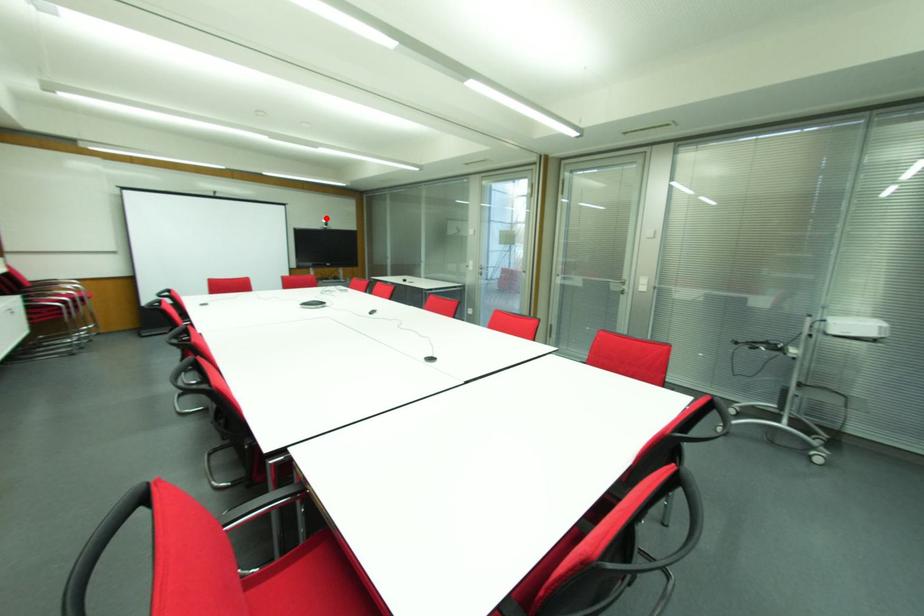
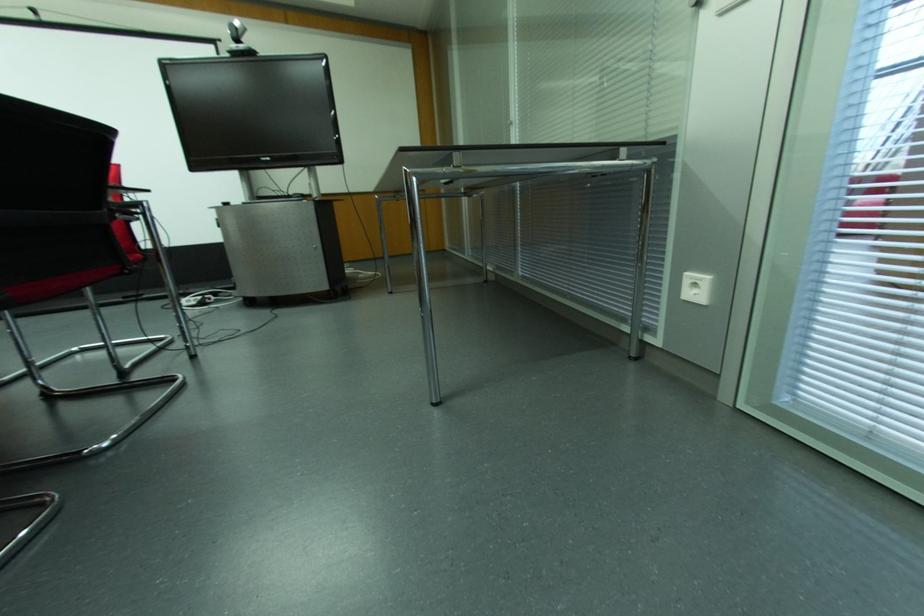
Question: I am providing you with two images of the same scene from different viewpoints. A red point is marked on the first image. Can you still see the location of the red point in image 2?

Choices:
 (A) Yes
 (B) No

Answer: (A)